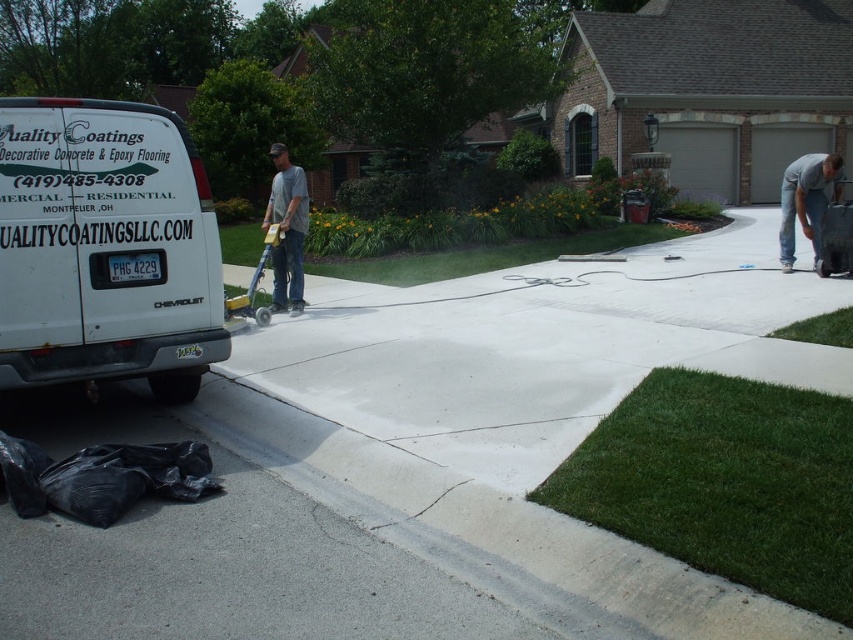
You are a customer looking to install epoxy flooring on your driveway. You see the smooth concrete driveway at center and the gray cotton shirt at upper right in the image. Which object is positioned to the left of the other?

The smooth concrete driveway at center is to the left of gray cotton shirt at upper right according to the description.

You are standing on the smooth concrete driveway at center and want to get to the white matte van at left. Which direction should you walk to reach the van?

Since the smooth concrete driveway at center is closer to the viewer than the white matte van at left, you should walk towards the left direction to reach the white matte van at left.

You are standing at the entrance of the driveway and want to walk towards the two points marked on the driveway. Which point would you reach first, point (122,433) or point (274,280)?

You would reach point (122,433) first because it is closer to you than point (274,280).